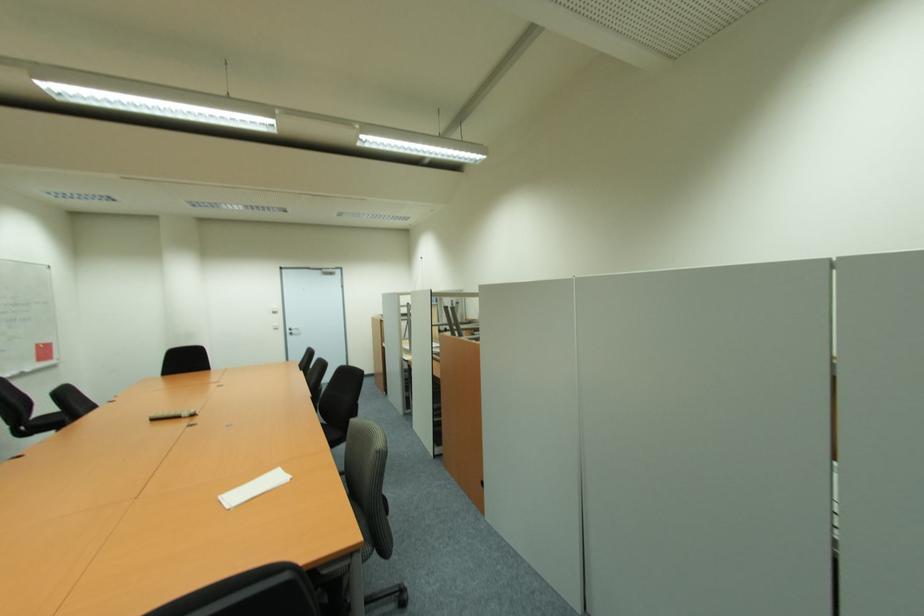
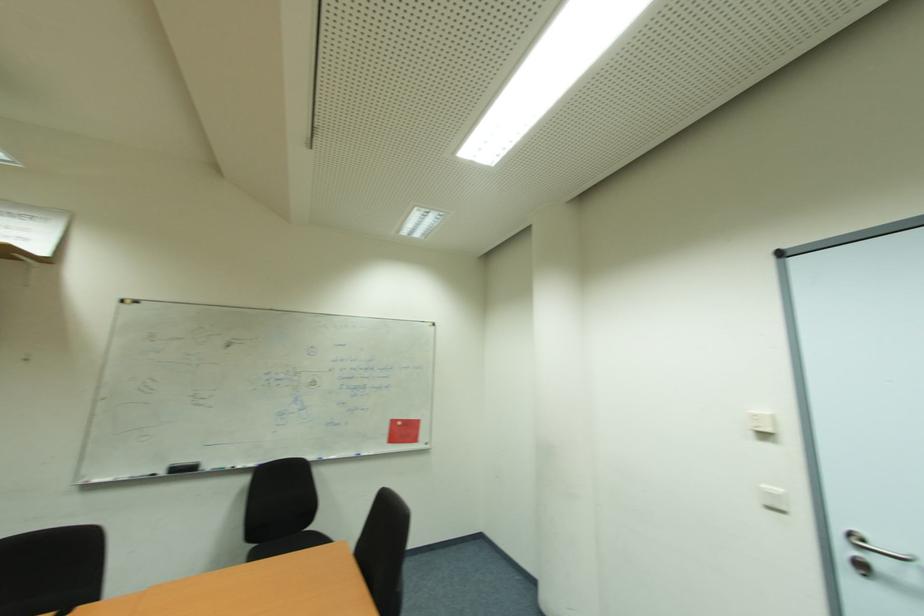
The point at (282, 325) is marked in the first image. Where is the corresponding point in the second image?

(784, 492)